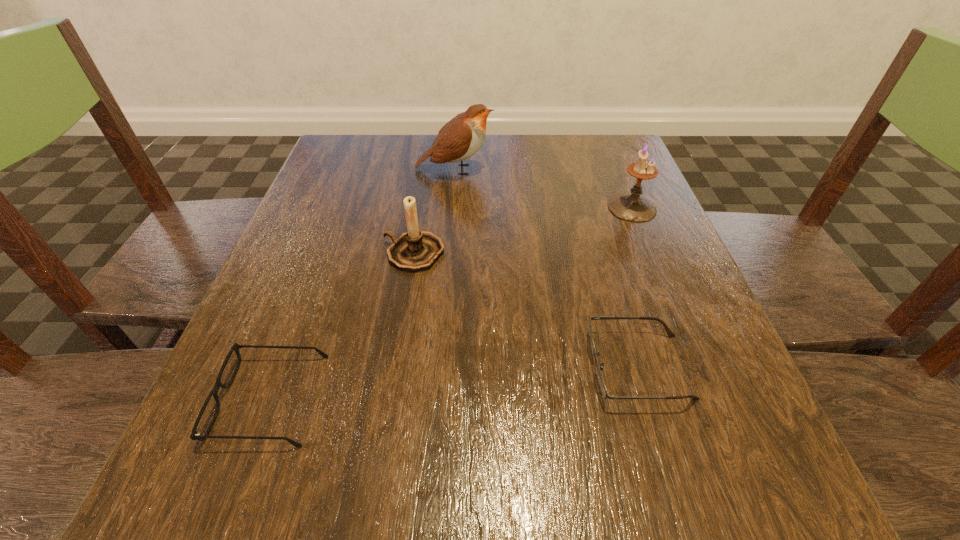
Locate an element on the screen. Image resolution: width=960 pixels, height=540 pixels. the farthest object is located at coordinates [460, 138].

The image size is (960, 540). Identify the location of the farther candle holder. (632, 207).

This screenshot has height=540, width=960. Find the location of `the second farthest object`. the second farthest object is located at coordinates (632, 207).

The height and width of the screenshot is (540, 960). I want to click on the third nearest object, so click(x=414, y=251).

The height and width of the screenshot is (540, 960). In order to click on the nearer candle holder in this screenshot , I will do `click(414, 251)`.

The image size is (960, 540). Find the location of `the left spectacles`. the left spectacles is located at coordinates (194, 435).

I want to click on the right spectacles, so click(602, 386).

At what (x,y) coordinates should I click in order to perform the action: click on free spot located at the face of the farthest object. Please return your answer as a coordinate pair (x, y). Looking at the image, I should click on (610, 170).

Find the location of a particular element. This screenshot has height=540, width=960. free location located 0.270m on the back of the farther candle holder is located at coordinates (602, 135).

Where is `vacant area located on the right of the nearer candle holder`? The height and width of the screenshot is (540, 960). vacant area located on the right of the nearer candle holder is located at coordinates (627, 253).